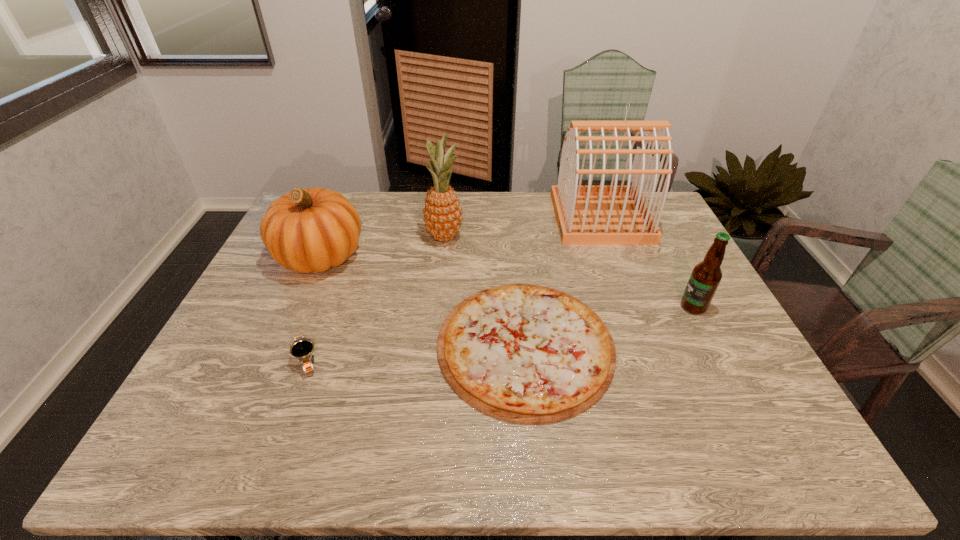
In order to click on vacant space in between the pineapple and the birdcage in this screenshot , I will do (x=522, y=228).

Locate an element on the screen. empty space between the beer bottle and the birdcage is located at coordinates (647, 262).

Identify the location of empty space that is in between the birdcage and the shortest object. This screenshot has height=540, width=960. [x=563, y=281].

This screenshot has width=960, height=540. What are the coordinates of `vacant point located between the beer bottle and the pumpkin` in the screenshot? It's located at (507, 281).

This screenshot has width=960, height=540. What are the coordinates of `empty space between the beer bottle and the pizza` in the screenshot? It's located at (610, 326).

The height and width of the screenshot is (540, 960). Identify the location of free spot between the shortest object and the watch. (416, 352).

At what (x,y) coordinates should I click in order to perform the action: click on free area in between the birdcage and the beer bottle. Please return your answer as a coordinate pair (x, y). Looking at the image, I should click on (647, 262).

The height and width of the screenshot is (540, 960). I want to click on vacant point located between the birdcage and the pineapple, so click(x=522, y=228).

Image resolution: width=960 pixels, height=540 pixels. I want to click on object that can be found as the closest to the beer bottle, so click(523, 353).

Identify which object is the closest to the fifth tallest object. Please provide its 2D coordinates. Your answer should be formatted as a tuple, i.e. [(x, y)], where the tuple contains the x and y coordinates of a point satisfying the conditions above.

[(306, 230)]